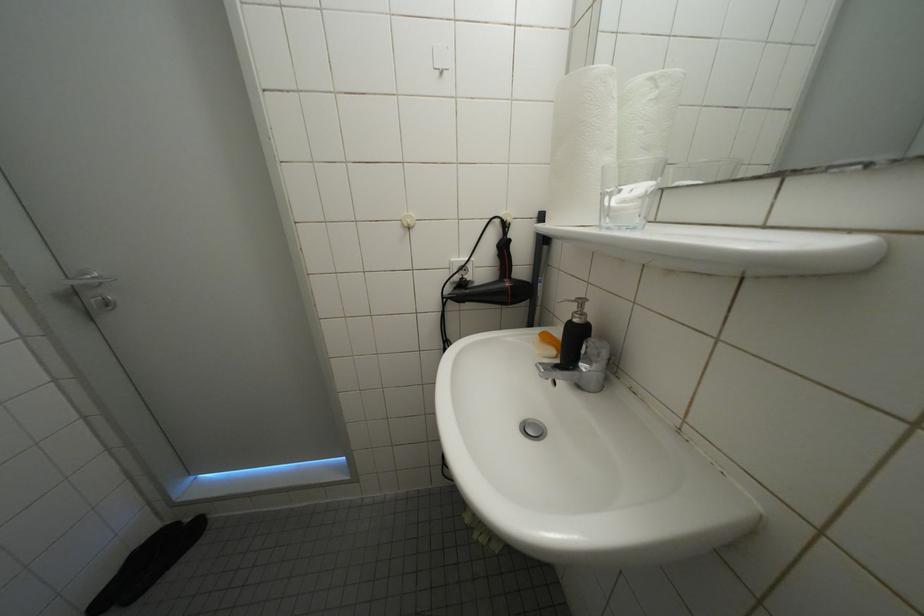
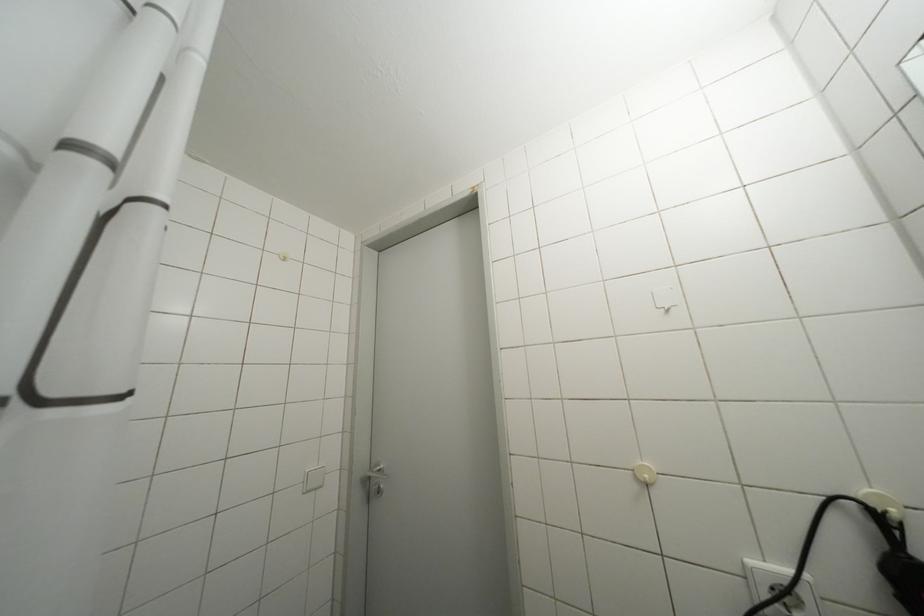
In the scene shown: First-person continuous shooting, in which direction is the camera rotating?

The camera rotated toward left-up.